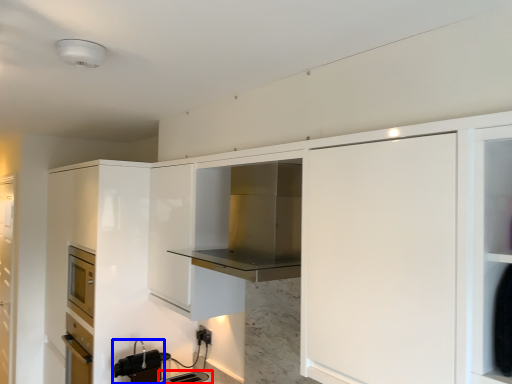
Question: Which object appears closest to the camera in this image, appliance (highlighted by a red box) or appliance (highlighted by a blue box)?

Choices:
 (A) appliance
 (B) appliance

Answer: (A)